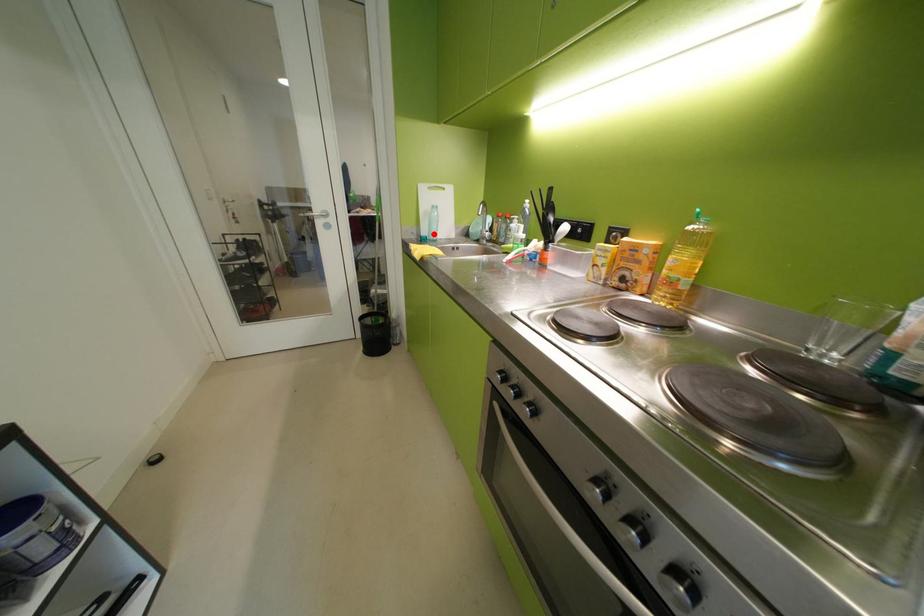
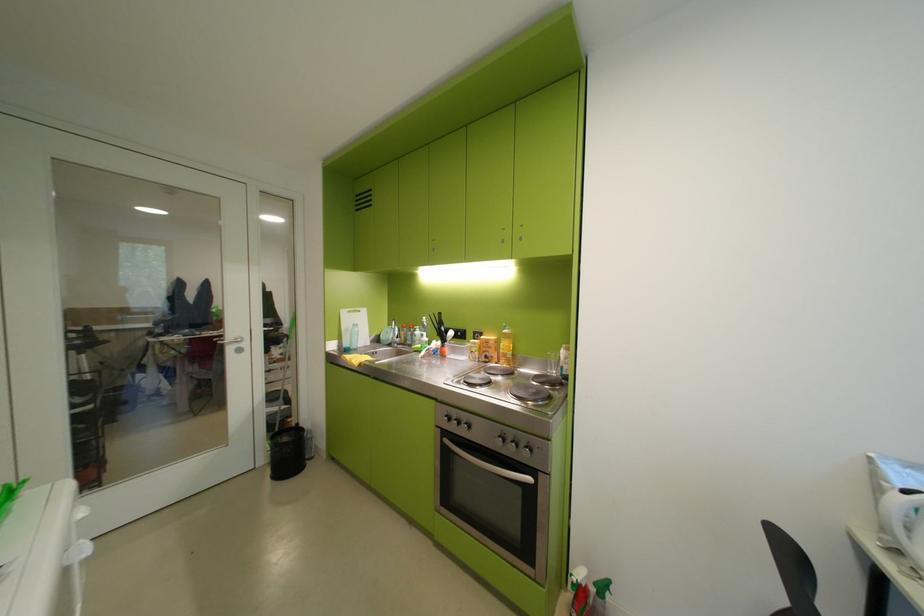
In the second image, find the point that corresponds to the highlighted location in the first image.

(357, 345)